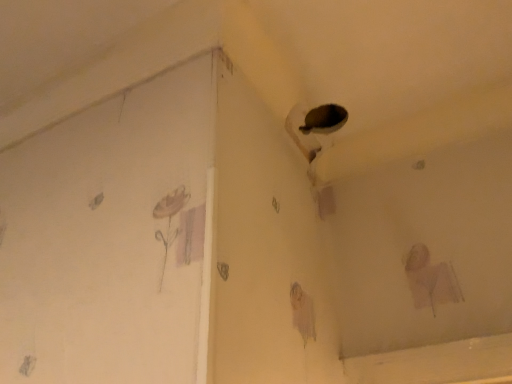
This screenshot has width=512, height=384. What do you see at coordinates (324, 119) in the screenshot? I see `matte plastic hole at upper center` at bounding box center [324, 119].

Measure the distance between matte plastic hole at upper center and camera.

A distance of 75.10 centimeters exists between matte plastic hole at upper center and camera.

Where is `matte plastic hole at upper center`? Image resolution: width=512 pixels, height=384 pixels. matte plastic hole at upper center is located at coordinates (324, 119).

The width and height of the screenshot is (512, 384). I want to click on matte plastic hole at upper center, so click(x=324, y=119).